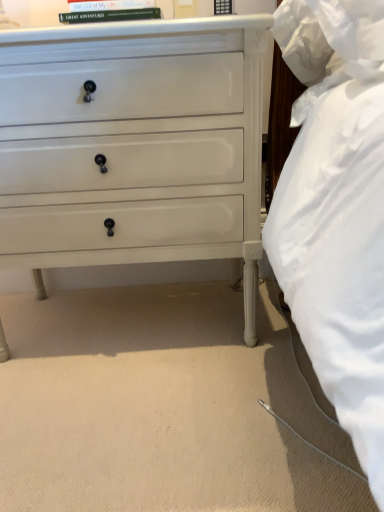
Question: Is white painted wood chest of drawers at center to the left or to the right of hardcover book at upper center in the image?

Choices:
 (A) right
 (B) left

Answer: (B)

Question: Considering the positions of white painted wood chest of drawers at center and hardcover book at upper center in the image, is white painted wood chest of drawers at center taller or shorter than hardcover book at upper center?

Choices:
 (A) tall
 (B) short

Answer: (A)

Question: From the image's perspective, is white painted wood chest of drawers at center located above or below hardcover book at upper center?

Choices:
 (A) below
 (B) above

Answer: (A)

Question: In terms of height, does hardcover book at upper center look taller or shorter compared to white painted wood chest of drawers at center?

Choices:
 (A) tall
 (B) short

Answer: (B)

Question: Relative to white painted wood chest of drawers at center, is hardcover book at upper center in front or behind?

Choices:
 (A) behind
 (B) front

Answer: (A)

Question: In terms of width, does hardcover book at upper center look wider or thinner when compared to white painted wood chest of drawers at center?

Choices:
 (A) wide
 (B) thin

Answer: (B)

Question: Does point (99, 3) appear closer or farther from the camera than point (178, 144)?

Choices:
 (A) farther
 (B) closer

Answer: (B)